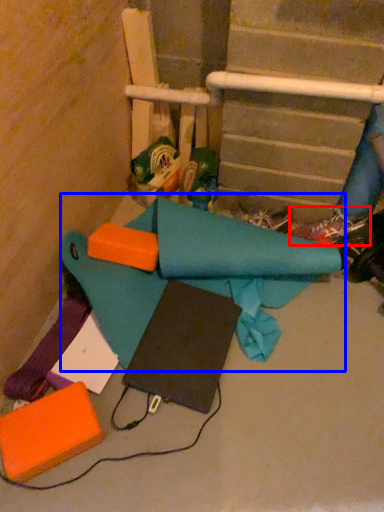
Question: Among these objects, which one is farthest to the camera, footwear (highlighted by a red box) or fabric (highlighted by a blue box)?

Choices:
 (A) footwear
 (B) fabric

Answer: (A)